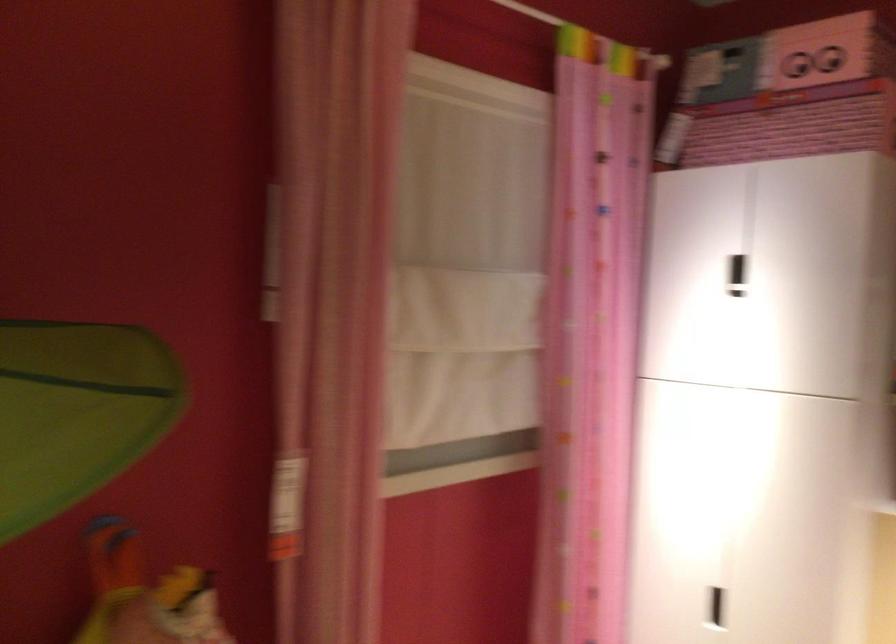
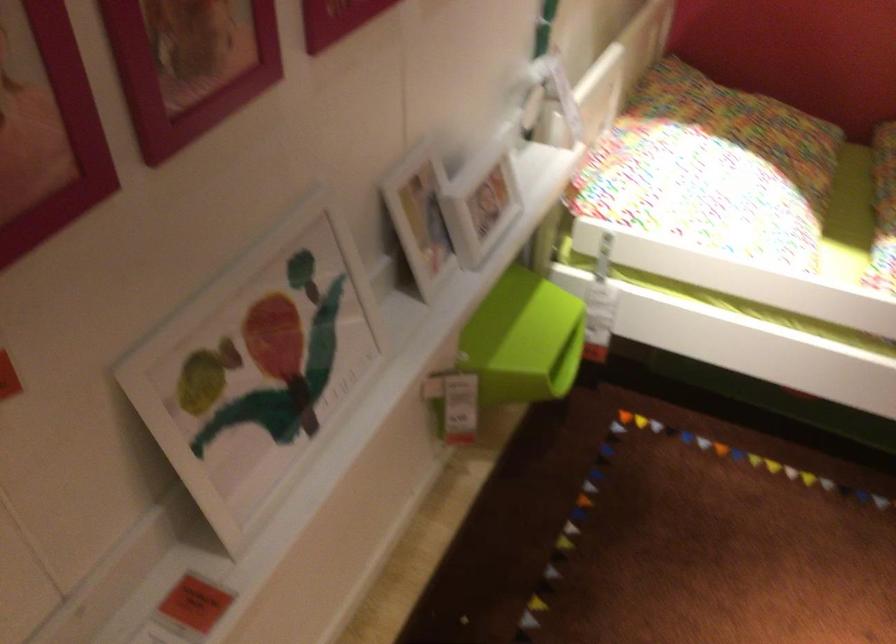
Looking at this image, based on the continuous images, in which direction is the camera rotating?

The camera rotated toward left-down.